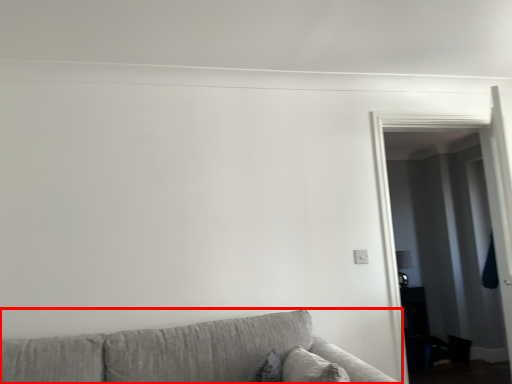
Question: From the image's perspective, what is the correct spatial relationship of studio couch (annotated by the red box) in relation to glass door?

Choices:
 (A) above
 (B) below

Answer: (B)